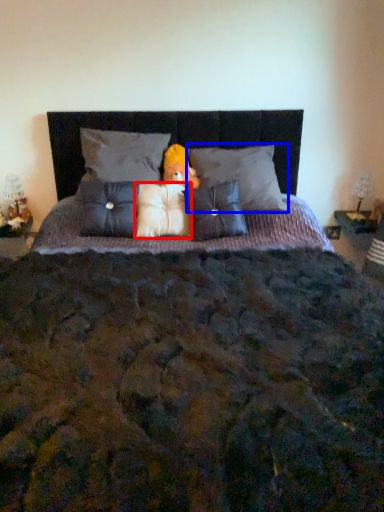
Question: Which object appears farthest to the camera in this image, pillow (highlighted by a red box) or pillow (highlighted by a blue box)?

Choices:
 (A) pillow
 (B) pillow

Answer: (A)